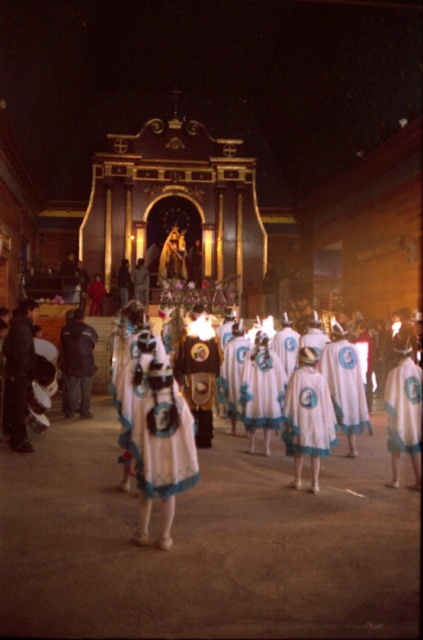
Question: Is the position of white fabric dress at center less distant than that of white cotton dress at center?

Choices:
 (A) yes
 (B) no

Answer: (A)

Question: Can you confirm if white fabric dress at center is thinner than white cotton dress at center?

Choices:
 (A) yes
 (B) no

Answer: (B)

Question: Which of the following is the closest to the observer?

Choices:
 (A) white fabric dress at center
 (B) white cotton dress at center

Answer: (A)

Question: Is white fabric dress at center further to camera compared to white cotton dress at center?

Choices:
 (A) no
 (B) yes

Answer: (A)

Question: Which point appears farthest from the camera in this image?

Choices:
 (A) (169, 380)
 (B) (249, 353)

Answer: (B)

Question: Which point appears closest to the camera in this image?

Choices:
 (A) (159, 404)
 (B) (280, 369)

Answer: (A)